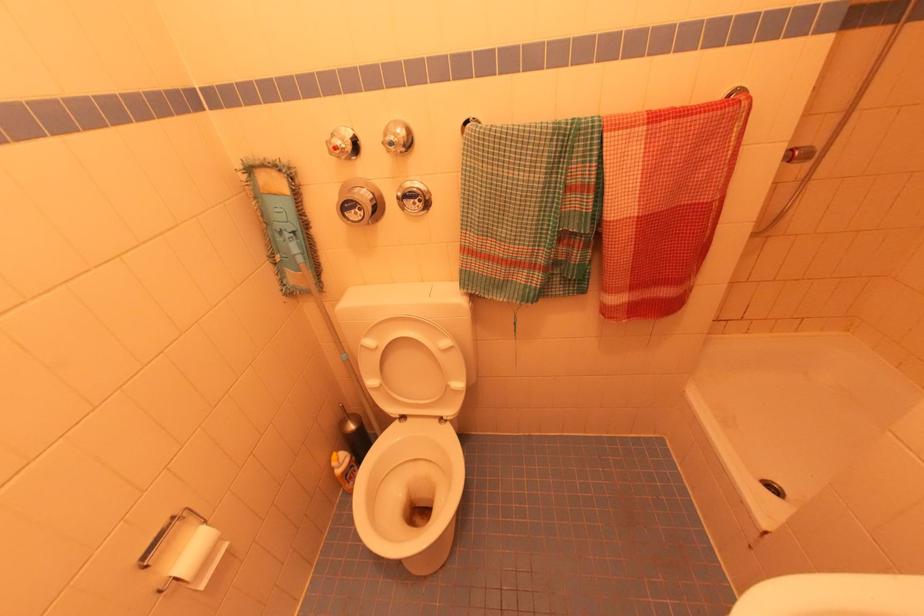
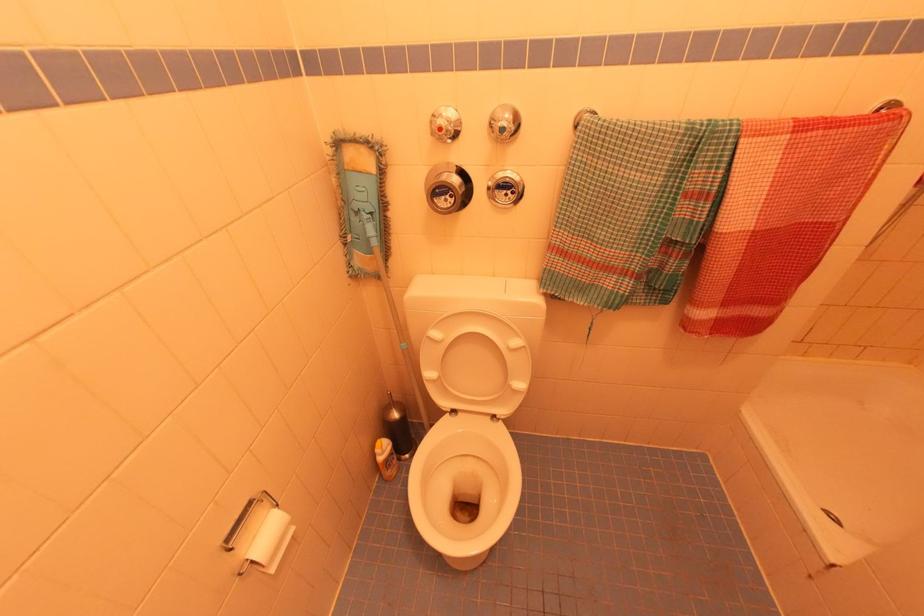
Find the pixel in the second image that matches the point at 420,201 in the first image.

(515, 193)